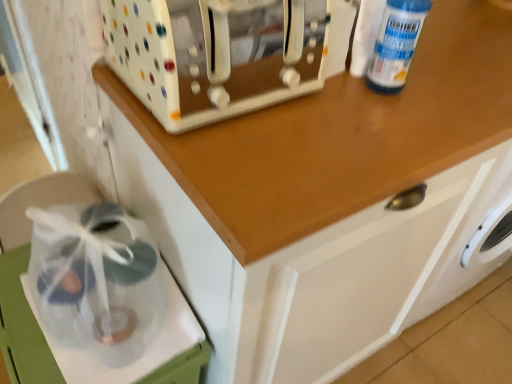
Identify the location of space that is in front of clear plastic bottle at upper right. (380, 132).